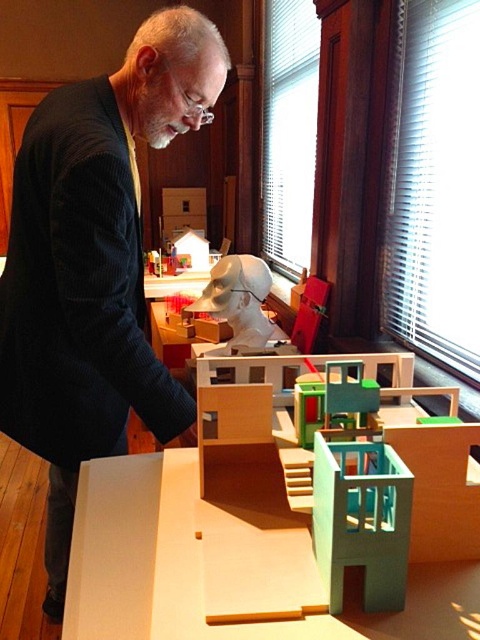
You are an interior designer assessing the spatial arrangement of the model. Which object, the light blue plastic building at lower right or the white matte sculpture at center, would require a taller support structure to display properly?

The white matte sculpture at center requires a taller support structure since it is taller than the light blue plastic building at lower right.

You are an interior designer observing the scene. You need to place a new decorative item between the dark corduroy jacket at left and the white matte sculpture at center. Where should you position it to maintain visual balance?

To maintain visual balance, the new decorative item should be placed between the dark corduroy jacket at left and the white matte sculpture at center, closer to the white matte sculpture at center since the dark corduroy jacket at left is located below it.